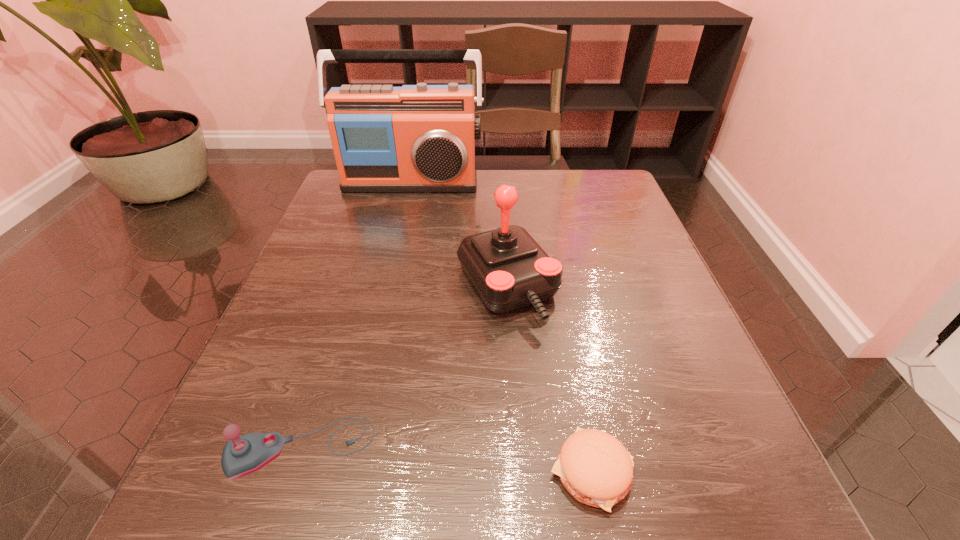
I want to click on free space at the far edge of the desktop, so 526,217.

Locate an element on the screen. The height and width of the screenshot is (540, 960). blank area at the near edge is located at coordinates (430, 496).

What are the coordinates of `vacant region at the left edge` in the screenshot? It's located at (243, 418).

In the image, there is a desktop. At what (x,y) coordinates should I click in order to perform the action: click on vacant space at the right edge. Please return your answer as a coordinate pair (x, y). This screenshot has width=960, height=540. Looking at the image, I should click on (573, 242).

What are the coordinates of `free space at the near left corner of the desktop` in the screenshot? It's located at (273, 502).

Find the location of a particular element. This screenshot has width=960, height=540. free space at the far right corner of the desktop is located at coordinates (619, 205).

Where is `vacant space in between the tallest object and the shortest object`? The width and height of the screenshot is (960, 540). vacant space in between the tallest object and the shortest object is located at coordinates (501, 327).

The image size is (960, 540). I want to click on vacant space that is in between the nearer joystick and the shortest object, so click(x=446, y=460).

I want to click on free space between the left joystick and the patty, so click(x=446, y=460).

You are a GUI agent. You are given a task and a screenshot of the screen. Output one action in this format:
    pyautogui.click(x=<x>, y=<y>)
    Task: Click on the vacant space in between the right joystick and the shortest object
    The image size is (960, 540).
    Given the screenshot: What is the action you would take?
    pyautogui.click(x=549, y=379)